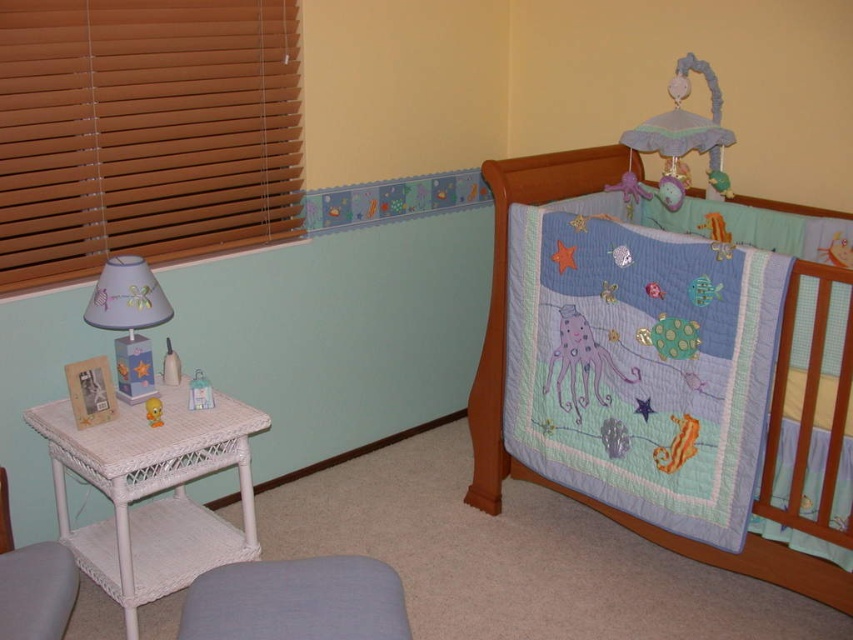
Question: From the image, what is the correct spatial relationship of embroidered cotton crib quilt at upper right in relation to white wicker chair at lower left?

Choices:
 (A) above
 (B) below

Answer: (A)

Question: Which of the following is the closest to the observer?

Choices:
 (A) white wicker table at lower left
 (B) embroidered cotton crib quilt at upper right
 (C) white wicker chair at lower left
 (D) yellow matte plush toy at lower left

Answer: (C)

Question: Estimate the real-world distances between objects in this image. Which object is closer to the white wicker chair at lower left?

Choices:
 (A) matte paper lampshade at left
 (B) embroidered cotton crib quilt at upper right
 (C) white wicker table at lower left
 (D) light blue fabric stool at lower center

Answer: (C)

Question: Is the position of wooden blinds at left more distant than that of yellow matte plush toy at lower left?

Choices:
 (A) yes
 (B) no

Answer: (B)

Question: Which object is positioned closest to the wooden blinds at left?

Choices:
 (A) light blue fabric stool at lower center
 (B) embroidered cotton crib quilt at upper right
 (C) white wicker table at lower left
 (D) white wicker chair at lower left

Answer: (C)

Question: In this image, where is embroidered cotton crib quilt at upper right located relative to white wicker chair at lower left?

Choices:
 (A) right
 (B) left

Answer: (A)